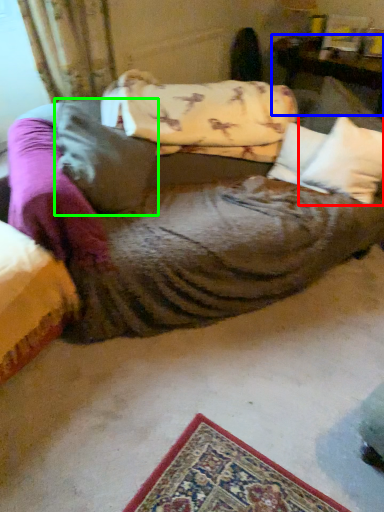
Question: Based on their relative distances, which object is farther from pillow (highlighted by a red box)? Choose from furniture (highlighted by a blue box) and pillow (highlighted by a green box).

Choices:
 (A) furniture
 (B) pillow

Answer: (B)